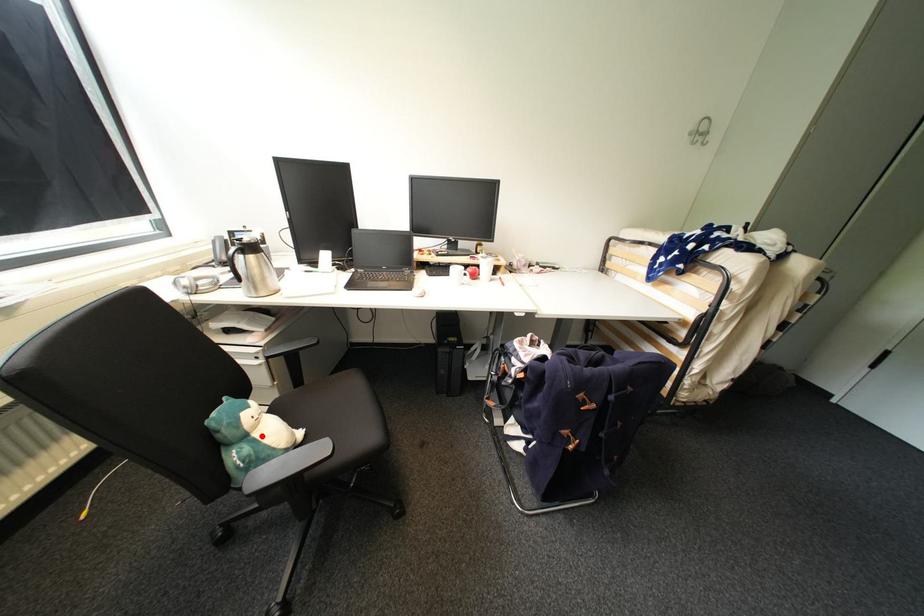
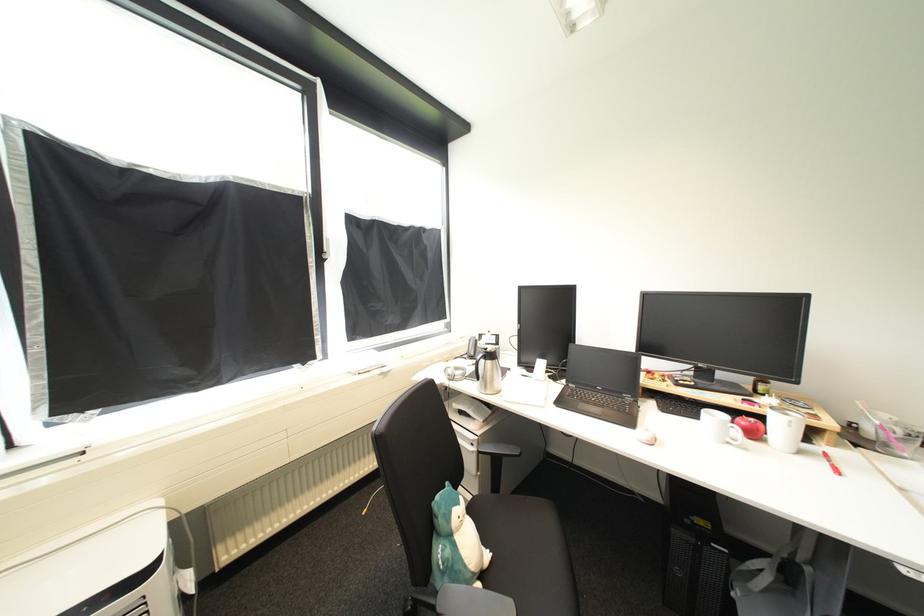
Question: I am providing you with two images of the same scene from different viewpoints. A red point is shown in image1. For the corresponding object point in image2, is it positioned nearer or farther from the camera?

Choices:
 (A) Nearer
 (B) Farther

Answer: (B)